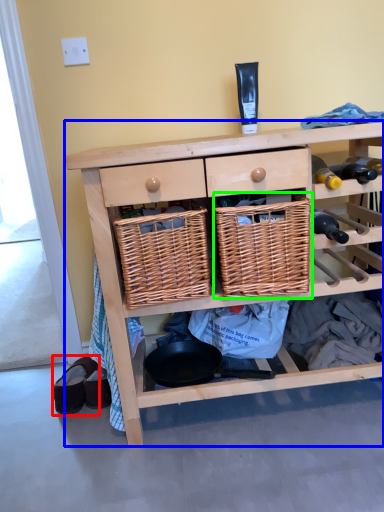
Question: Which object is positioned closest to footwear (highlighted by a red box)? Select from shelf (highlighted by a blue box) and basket (highlighted by a green box).

Choices:
 (A) shelf
 (B) basket

Answer: (A)